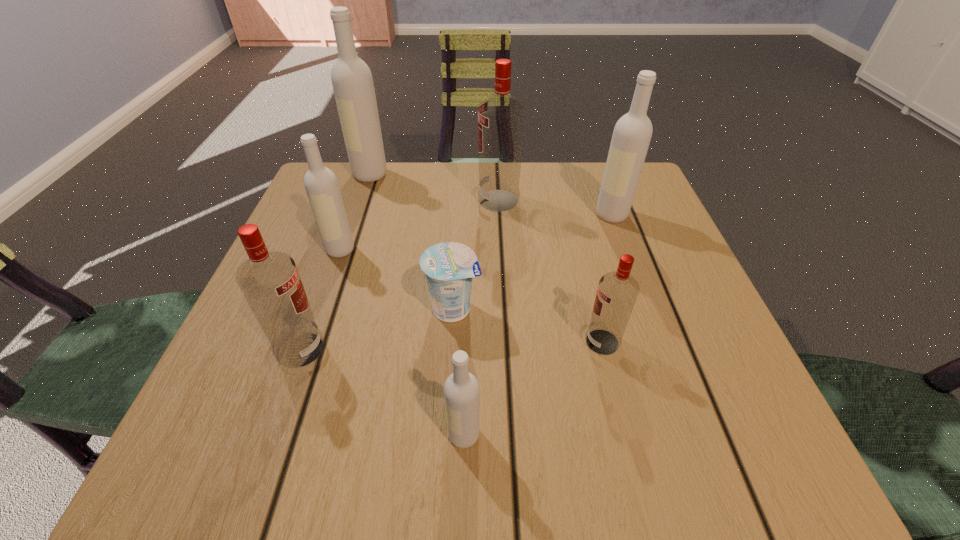
Find the location of a particular element. This screenshot has height=540, width=960. white vodka identified as the second closest to the smallest red vodka is located at coordinates (632, 133).

Choose which white vodka is the nearest neighbor to the biggest red vodka. Please provide its 2D coordinates. Your answer should be formatted as a tuple, i.e. [(x, y)], where the tuple contains the x and y coordinates of a point satisfying the conditions above.

[(632, 133)]

This screenshot has height=540, width=960. Find the location of `the closest red vodka to the rightmost vodka`. the closest red vodka to the rightmost vodka is located at coordinates (501, 118).

At what (x,y) coordinates should I click in order to perform the action: click on red vodka that can be found as the closest to the shortest object. Please return your answer as a coordinate pair (x, y). The width and height of the screenshot is (960, 540). Looking at the image, I should click on (270, 282).

Find the location of `free space in the image that satisfies the following two spatial constraints: 1. on the front side of the farthest object; 2. on the front label of the second biggest red vodka`. free space in the image that satisfies the following two spatial constraints: 1. on the front side of the farthest object; 2. on the front label of the second biggest red vodka is located at coordinates (311, 349).

The image size is (960, 540). Find the location of `vacant region that satisfies the following two spatial constraints: 1. on the front label of the second red vodka from right to left; 2. on the right side of the rightmost white vodka`. vacant region that satisfies the following two spatial constraints: 1. on the front label of the second red vodka from right to left; 2. on the right side of the rightmost white vodka is located at coordinates (499, 215).

You are a GUI agent. You are given a task and a screenshot of the screen. Output one action in this format:
    pyautogui.click(x=<x>, y=<y>)
    Task: Click on the vacant position in the image that satisfies the following two spatial constraints: 1. on the front side of the blue yogurt; 2. on the left side of the second smallest white vodka
    The image size is (960, 540).
    Given the screenshot: What is the action you would take?
    point(320,309)

Locate an element on the screen. The height and width of the screenshot is (540, 960). vacant space that satisfies the following two spatial constraints: 1. on the front label of the smallest red vodka; 2. on the front side of the nearest white vodka is located at coordinates (626, 435).

Image resolution: width=960 pixels, height=540 pixels. I want to click on free space that satisfies the following two spatial constraints: 1. on the front side of the rightmost vodka; 2. on the front label of the second smallest red vodka, so click(660, 349).

Locate an element on the screen. The width and height of the screenshot is (960, 540). blank space that satisfies the following two spatial constraints: 1. on the front side of the fourth nearest vodka; 2. on the left side of the yogurt is located at coordinates (320, 309).